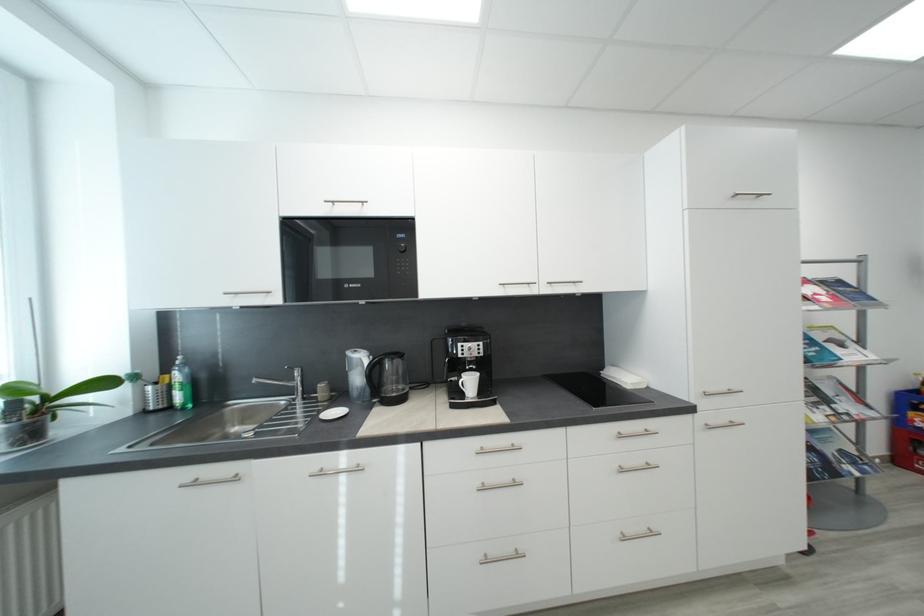
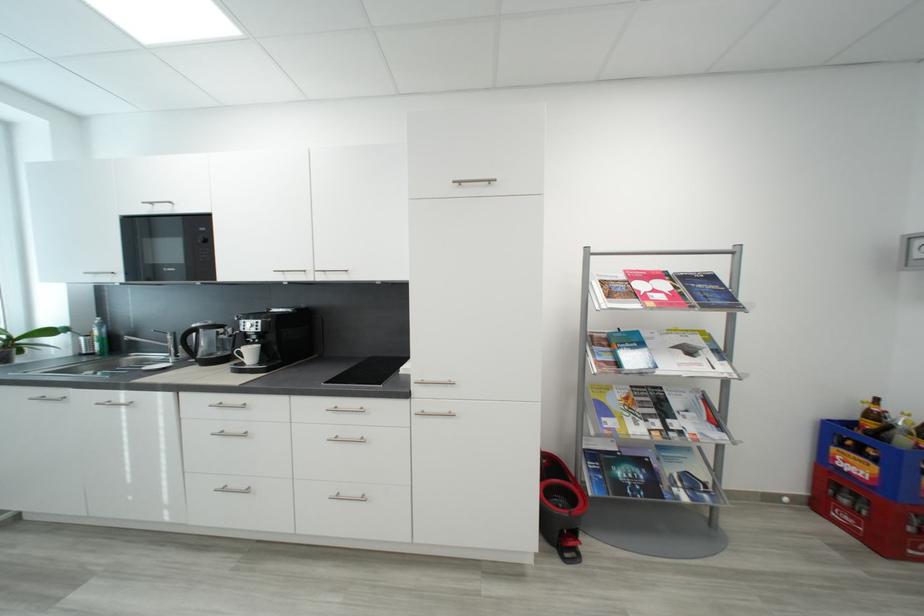
Find the pixel in the second image that matches [627,438] in the first image.

(343, 411)